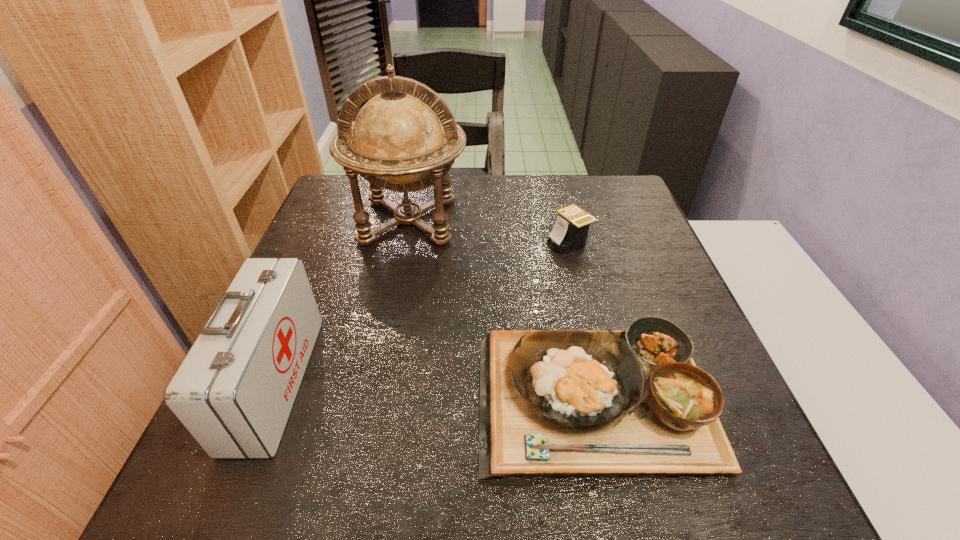
At what (x,y) coordinates should I click in order to perform the action: click on platter present at the near edge. Please return your answer as a coordinate pair (x, y). Looking at the image, I should click on (613, 403).

The width and height of the screenshot is (960, 540). I want to click on globe located at the left edge, so click(404, 139).

Where is `the first-aid kit that is at the left edge`? Image resolution: width=960 pixels, height=540 pixels. the first-aid kit that is at the left edge is located at coordinates pos(234,390).

The height and width of the screenshot is (540, 960). In order to click on object that is at the right edge in this screenshot , I will do `click(613, 403)`.

Identify the location of object at the far left corner. (404, 139).

Where is `object that is at the near left corner`? object that is at the near left corner is located at coordinates (234, 390).

Locate an element on the screen. The width and height of the screenshot is (960, 540). object that is at the near right corner is located at coordinates (613, 403).

Locate an element on the screen. free space at the far edge of the desktop is located at coordinates (549, 179).

Where is `vacant space at the near edge of the desktop`? The height and width of the screenshot is (540, 960). vacant space at the near edge of the desktop is located at coordinates (348, 468).

Find the location of a particular element. The width and height of the screenshot is (960, 540). blank space at the left edge is located at coordinates (328, 277).